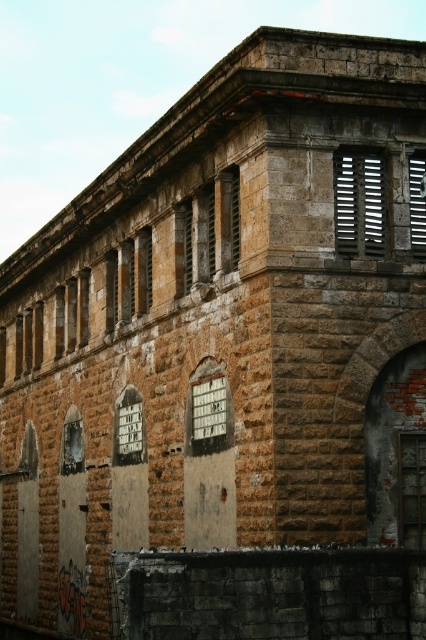
Between matte metal slats at upper right and white painted wood window at center, which one is positioned higher?

Positioned higher is matte metal slats at upper right.

Based on the photo, does matte metal slats at upper right appear over white painted wood window at center?

Indeed, matte metal slats at upper right is positioned over white painted wood window at center.

The height and width of the screenshot is (640, 426). In order to click on matte metal slats at upper right in this screenshot , I will do `click(359, 204)`.

Is matte metal slats at upper right thinner than matte wooden window at upper right?

In fact, matte metal slats at upper right might be wider than matte wooden window at upper right.

Is point (371, 248) positioned after point (422, 236)?

No, it is in front of (422, 236).

Where is `matte metal slats at upper right`? The image size is (426, 640). matte metal slats at upper right is located at coordinates (359, 204).

Who is more forward, (210, 397) or (409, 188)?

Point (409, 188) is in front.

Between point (218, 401) and point (422, 150), which one is positioned in front?

Point (422, 150)

Identify the location of white plastic window at center. This screenshot has width=426, height=640. (209, 406).